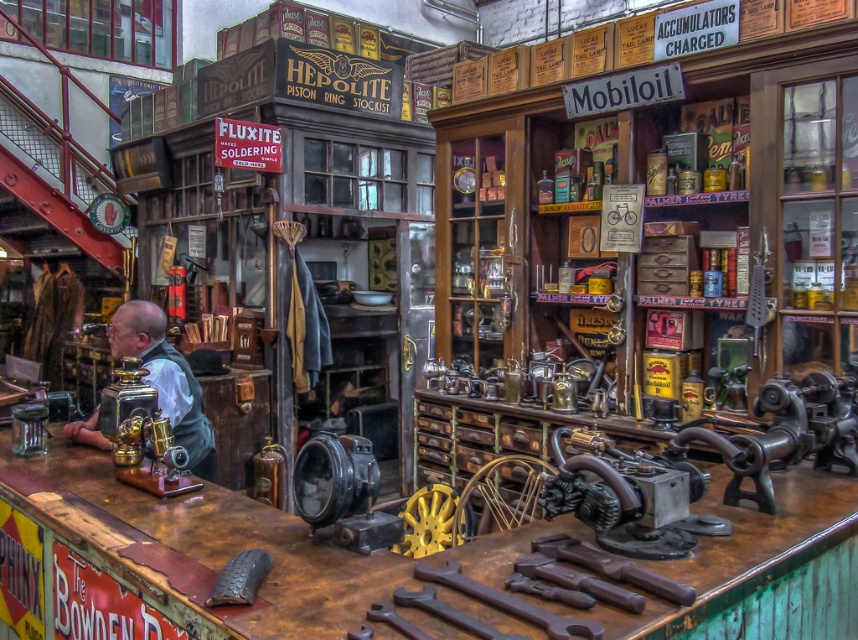
You are standing at the entrance of the workshop and see two points marked on the floor. The first point is at coordinate point (602, 563) and the second point is at coordinate point (130, 474). Which point is closer to you?

Point (602, 563) is closer to you because it is in front of point (130, 474).